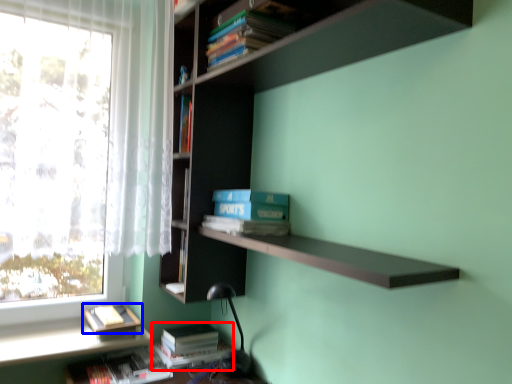
Question: Which object appears closest to the camera in this image, book (highlighted by a red box) or book (highlighted by a blue box)?

Choices:
 (A) book
 (B) book

Answer: (B)